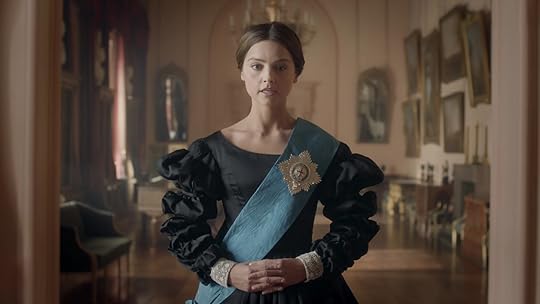
You are a GUI agent. You are given a task and a screenshot of the screen. Output one action in this format:
    pyautogui.click(x=<x>, y=<y>)
    Task: Click on the rug
    The width and height of the screenshot is (540, 304).
    Given the screenshot: What is the action you would take?
    [x=391, y=259]